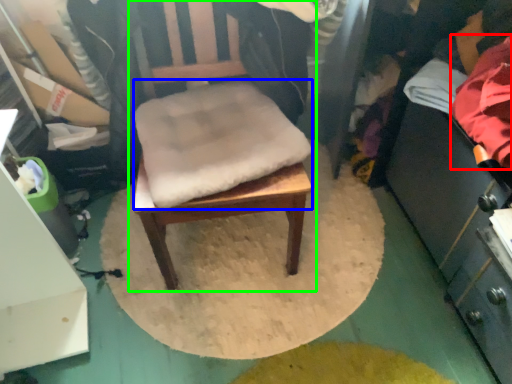
Question: Based on their relative distances, which object is nearer to clothing (highlighted by a red box)? Choose from footrest (highlighted by a blue box) and chair (highlighted by a green box).

Choices:
 (A) footrest
 (B) chair

Answer: (B)